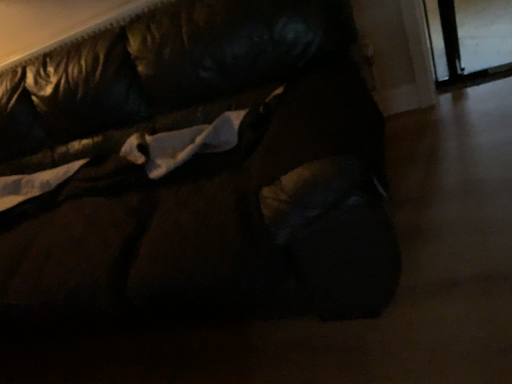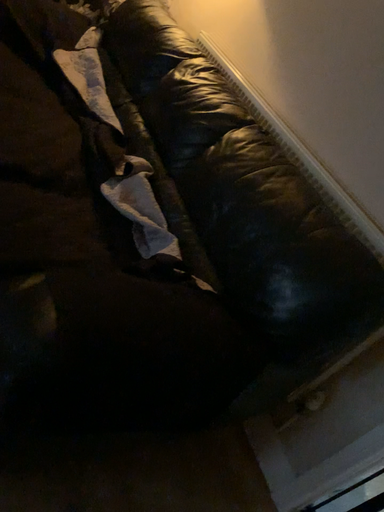
Question: How did the camera likely rotate when shooting the video?

Choices:
 (A) rotated upward
 (B) rotated downward

Answer: (A)